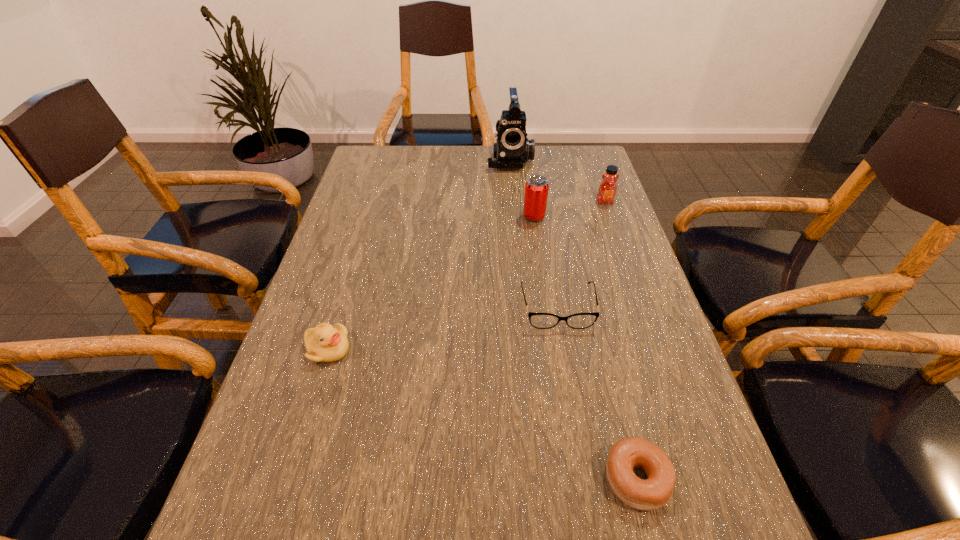
At what (x,y) coordinates should I click in order to perform the action: click on vacant space located 0.130m on the left of the soda can. Please return your answer as a coordinate pair (x, y). The image size is (960, 540). Looking at the image, I should click on (476, 217).

Identify the location of vacant space situated on the front label of the honey. The height and width of the screenshot is (540, 960). (612, 224).

You are a GUI agent. You are given a task and a screenshot of the screen. Output one action in this format:
    pyautogui.click(x=<x>, y=<y>)
    Task: Click on the vacant space located 0.120m on the front-facing side of the duckling
    
    Given the screenshot: What is the action you would take?
    pyautogui.click(x=408, y=349)

Identify the location of blank space located 0.330m on the back of the nearest object. This screenshot has width=960, height=540. (593, 305).

Where is `vacant space located on the front-facing side of the third nearest object`? The image size is (960, 540). vacant space located on the front-facing side of the third nearest object is located at coordinates (575, 409).

The image size is (960, 540). I want to click on object that is positioned at the far edge, so click(x=513, y=149).

This screenshot has height=540, width=960. Identify the location of object at the left edge. (325, 343).

Identify the location of honey situated at the right edge. The height and width of the screenshot is (540, 960). (608, 189).

The height and width of the screenshot is (540, 960). I want to click on bagel situated at the right edge, so click(x=631, y=453).

Locate an element on the screen. spectacles located at the right edge is located at coordinates (538, 320).